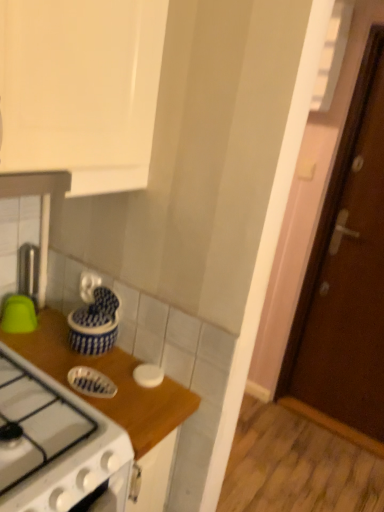
The height and width of the screenshot is (512, 384). I want to click on free space between white matte lid at center, the fourth kitchen appliance viewed from the left, and blue glossy jar at center, which is counted as the second kitchen appliance, starting from the left, so click(x=125, y=366).